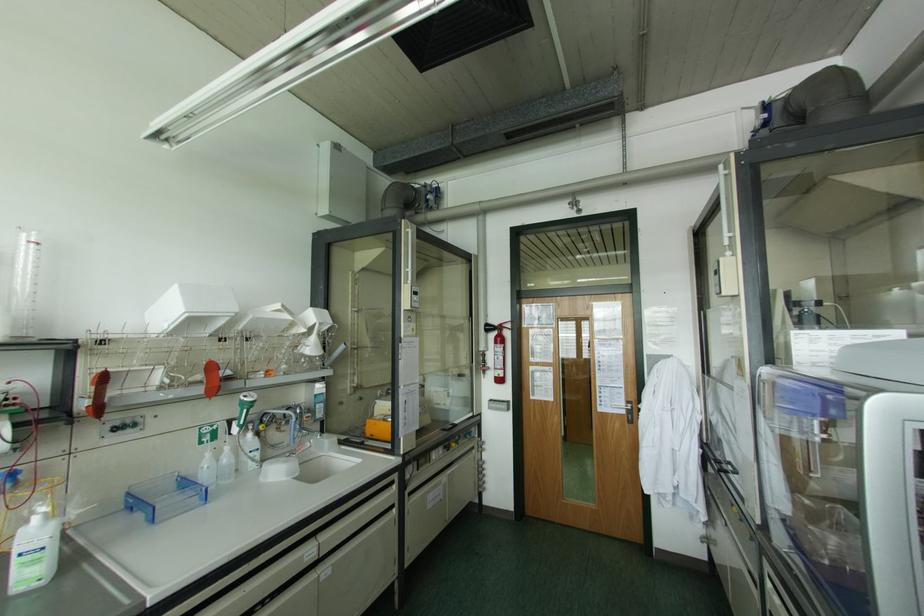
At what (x,y) coordinates should I click in order to perform the action: click on tall graduated cylinder. Please return your answer as a coordinate pair (x, y). This screenshot has width=924, height=616. Looking at the image, I should click on (23, 286).